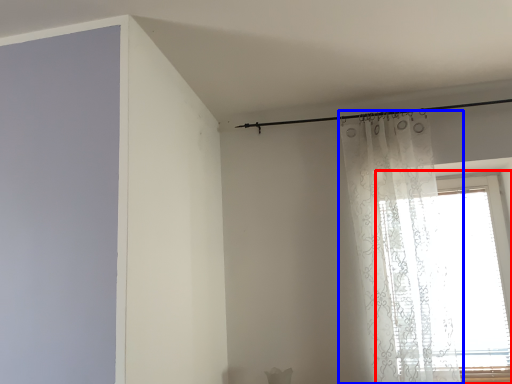
Question: Among these objects, which one is farthest to the camera, window (highlighted by a red box) or curtain (highlighted by a blue box)?

Choices:
 (A) window
 (B) curtain

Answer: (A)